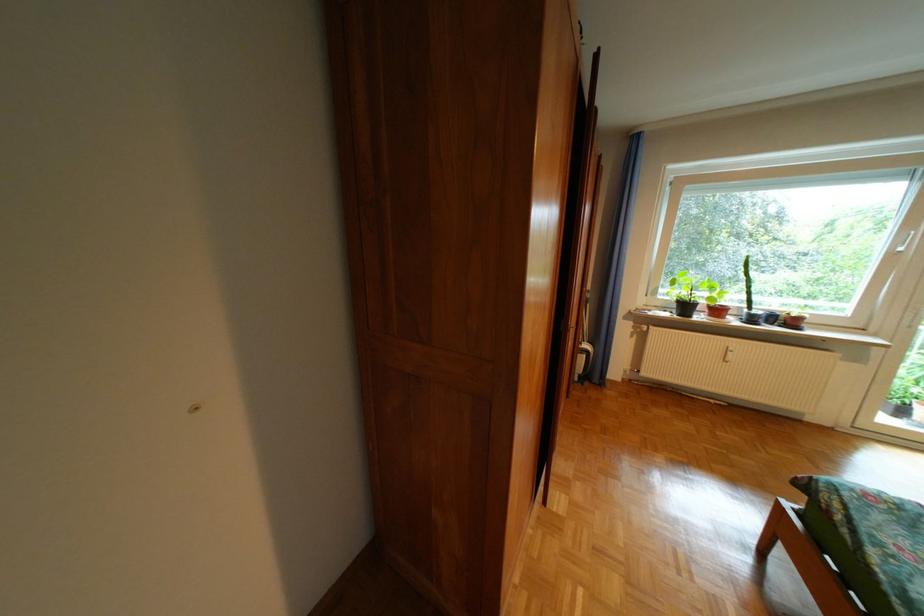
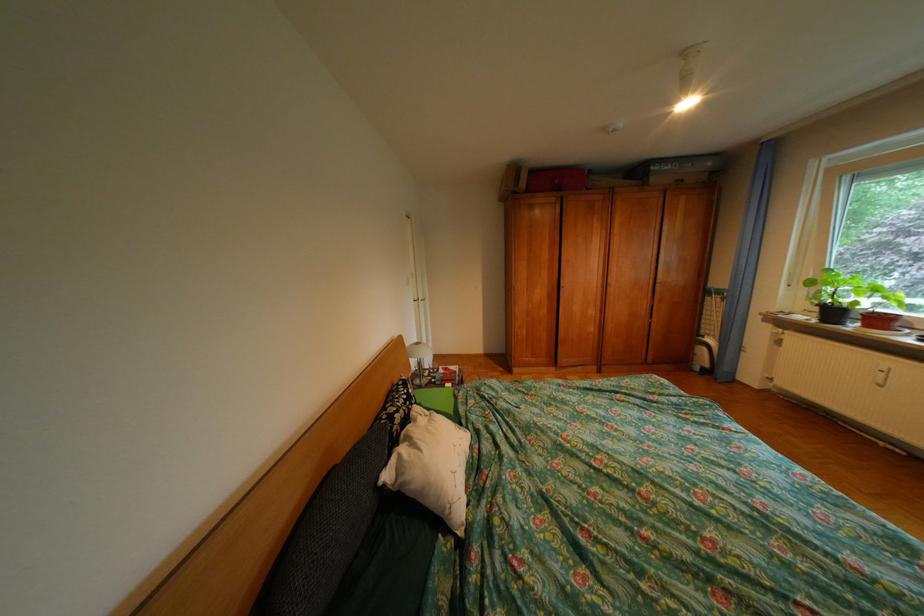
Where in the second image is the point corresponding to the point at 679,315 from the first image?

(819, 318)